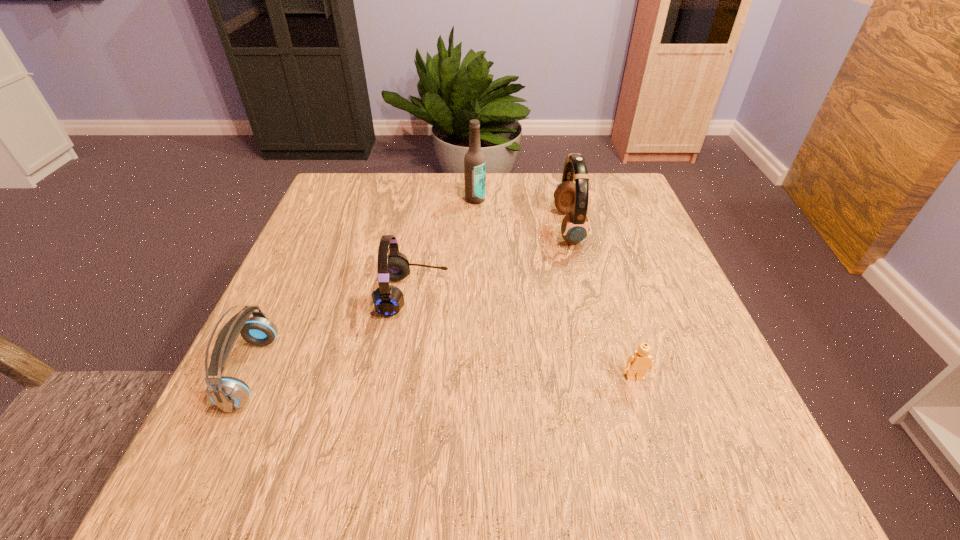
This screenshot has width=960, height=540. What are the coordinates of `the second closest headset to the second headset from right to left` in the screenshot? It's located at pyautogui.click(x=571, y=198).

Locate an element on the screen. This screenshot has width=960, height=540. free space in the image that satisfies the following two spatial constraints: 1. on the side of the farthest object with the label; 2. on the ear cups of the leftmost headset is located at coordinates (472, 372).